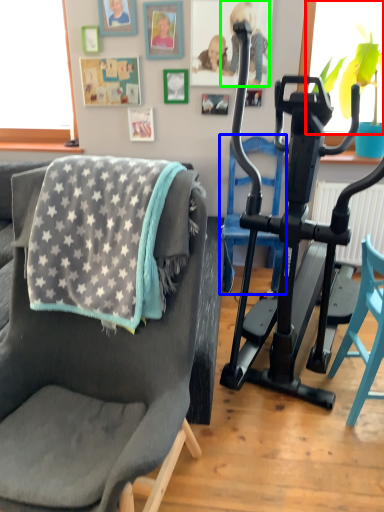
Question: Estimate the real-world distances between objects in this image. Which object is closer to window screen (highlighted by a red box), armchair (highlighted by a blue box) or person (highlighted by a green box)?

Choices:
 (A) armchair
 (B) person

Answer: (B)